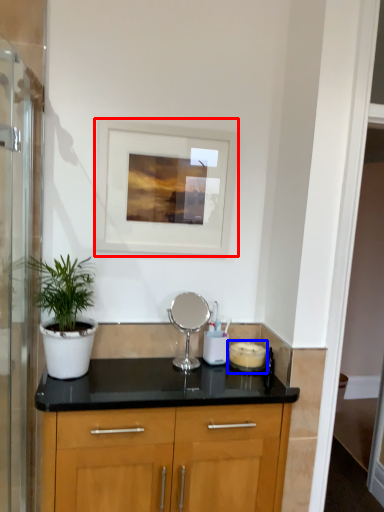
Question: Which object is further to the camera taking this photo, picture frame (highlighted by a red box) or appliance (highlighted by a blue box)?

Choices:
 (A) picture frame
 (B) appliance

Answer: (B)